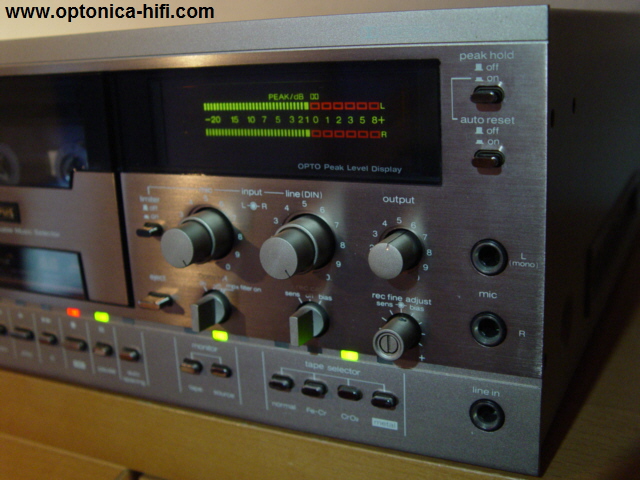
Locate an element on the screen. The width and height of the screenshot is (640, 480). indicator lights is located at coordinates (340, 352), (214, 331), (96, 316), (75, 313).